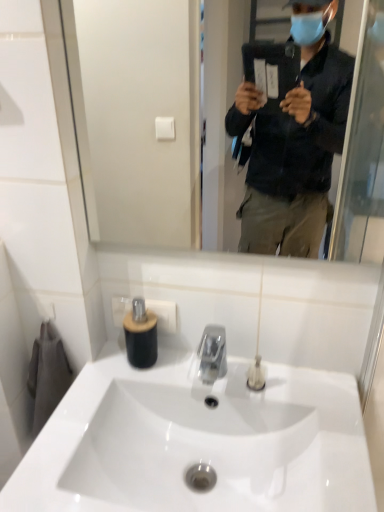
Question: Would you say white glossy sink at center is outside clear glass mirror at upper center?

Choices:
 (A) yes
 (B) no

Answer: (A)

Question: Does white glossy sink at center turn towards clear glass mirror at upper center?

Choices:
 (A) yes
 (B) no

Answer: (B)

Question: Does white glossy sink at center have a smaller size compared to clear glass mirror at upper center?

Choices:
 (A) no
 (B) yes

Answer: (A)

Question: Can you confirm if white glossy sink at center is bigger than clear glass mirror at upper center?

Choices:
 (A) no
 (B) yes

Answer: (B)

Question: From a real-world perspective, is white glossy sink at center on clear glass mirror at upper center?

Choices:
 (A) yes
 (B) no

Answer: (B)

Question: From the image's perspective, is white glossy sink at center on clear glass mirror at upper center?

Choices:
 (A) yes
 (B) no

Answer: (B)

Question: Considering the relative positions of clear glass mirror at upper center and clear plastic tube at center, the 1th toiletry viewed from the right, in the image provided, is clear glass mirror at upper center to the left of clear plastic tube at center, the 1th toiletry viewed from the right, from the viewer's perspective?

Choices:
 (A) no
 (B) yes

Answer: (B)

Question: From the image's perspective, is clear glass mirror at upper center over clear plastic tube at center, which ranks as the 2th toiletry in left-to-right order?

Choices:
 (A) yes
 (B) no

Answer: (A)

Question: From a real-world perspective, is clear glass mirror at upper center on clear plastic tube at center, the 1th toiletry viewed from the right?

Choices:
 (A) no
 (B) yes

Answer: (B)

Question: Is clear glass mirror at upper center oriented away from clear plastic tube at center, the 1th toiletry viewed from the right?

Choices:
 (A) no
 (B) yes

Answer: (A)

Question: Does clear glass mirror at upper center have a greater height compared to clear plastic tube at center, which ranks as the 2th toiletry in left-to-right order?

Choices:
 (A) no
 (B) yes

Answer: (B)

Question: Considering the relative sizes of clear glass mirror at upper center and clear plastic tube at center, which ranks as the 2th toiletry in left-to-right order, in the image provided, is clear glass mirror at upper center shorter than clear plastic tube at center, which ranks as the 2th toiletry in left-to-right order,?

Choices:
 (A) no
 (B) yes

Answer: (A)

Question: Are clear plastic tube at center, the 1th toiletry viewed from the right, and white glossy sink at center beside each other?

Choices:
 (A) yes
 (B) no

Answer: (B)